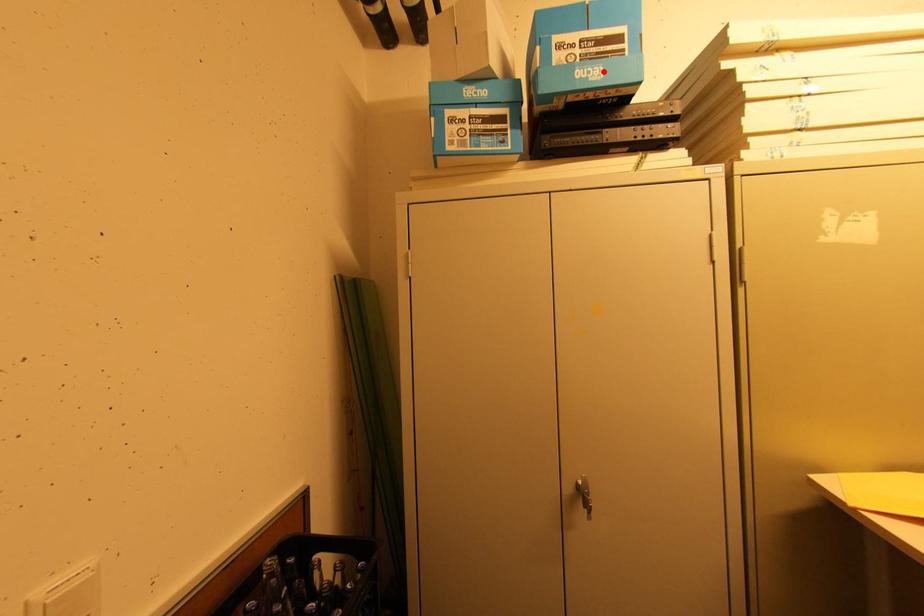
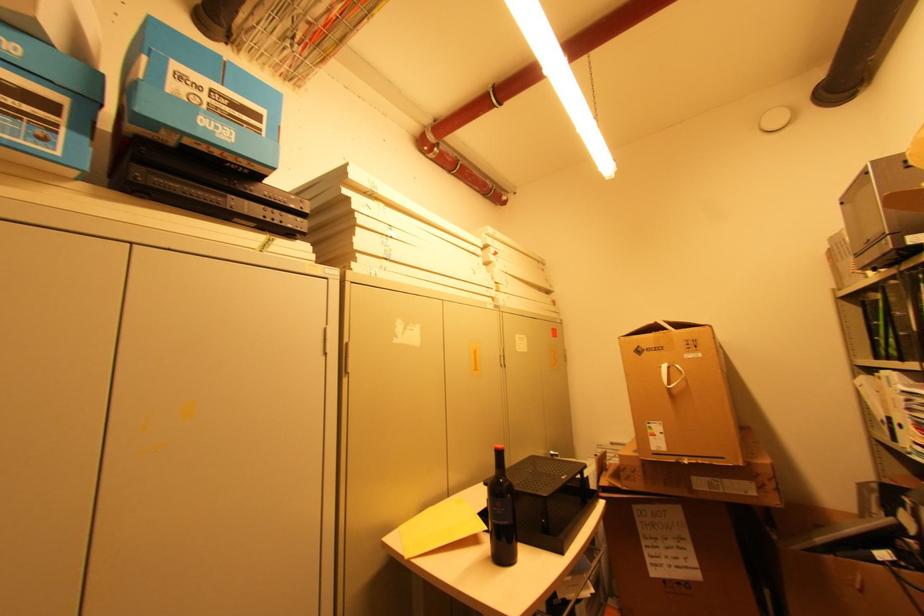
Locate, in the second image, the point that corresponds to the highlighted location in the first image.

(235, 134)